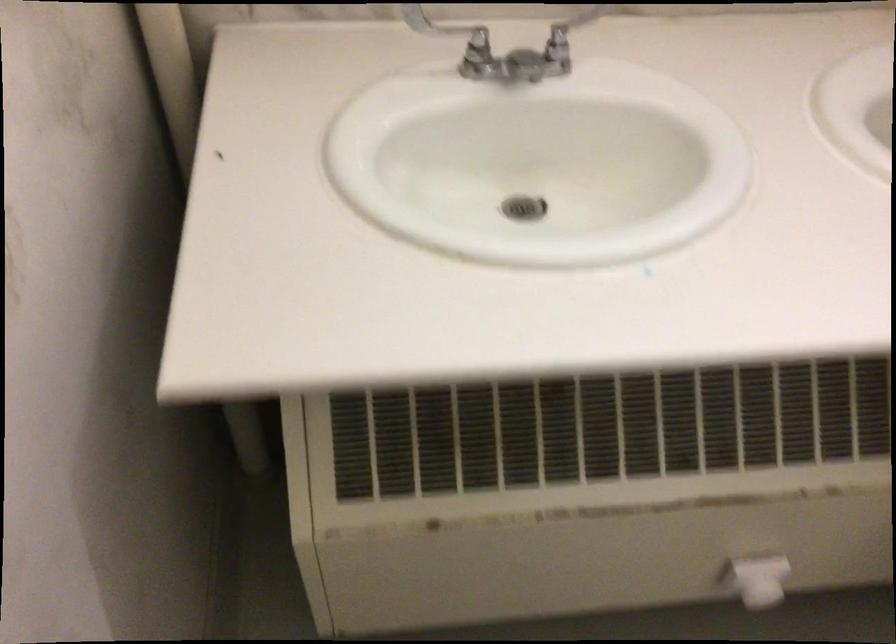
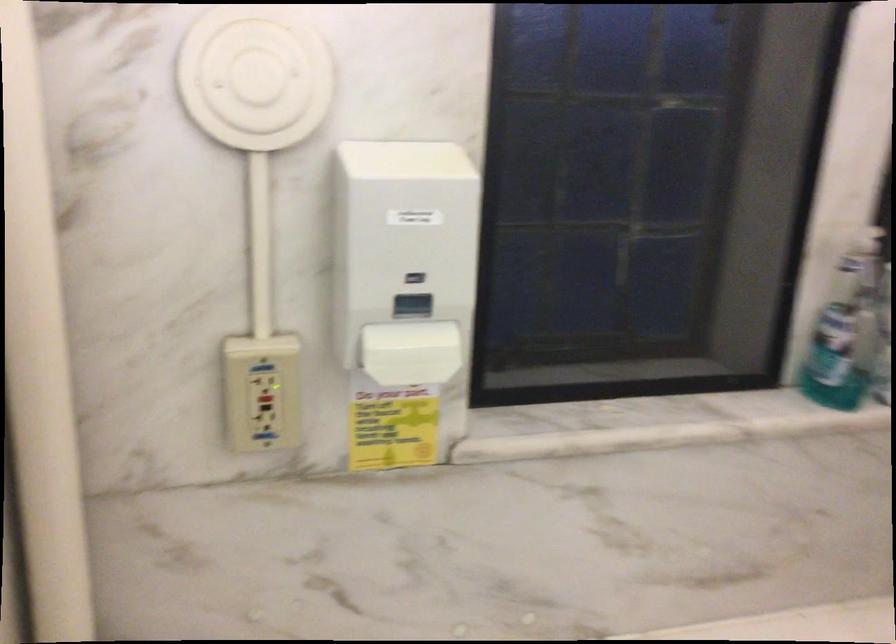
Question: The images are taken continuously from a first-person perspective. In which direction is your viewpoint rotating?

Choices:
 (A) Left
 (B) Right
 (C) Up
 (D) Down

Answer: (C)